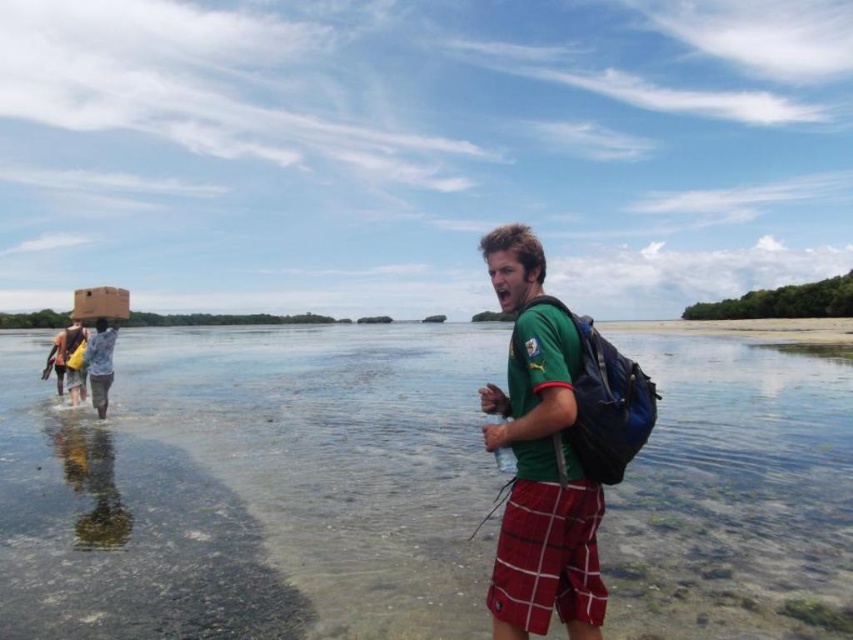
Question: Can you confirm if clear water at center is positioned to the right of green fabric shirt at center?

Choices:
 (A) no
 (B) yes

Answer: (A)

Question: Which object is farther from the camera taking this photo?

Choices:
 (A) cardboard box at left
 (B) green fabric shirt at center

Answer: (A)

Question: Among these points, which one is farthest from the camera?

Choices:
 (A) (91, 320)
 (B) (254, 342)

Answer: (B)

Question: Among these points, which one is nearest to the camera?

Choices:
 (A) (113, 298)
 (B) (743, 513)

Answer: (B)

Question: Can you confirm if clear water at center is positioned below green fabric shirt at center?

Choices:
 (A) yes
 (B) no

Answer: (B)

Question: Does clear water at center have a greater width compared to light blue fabric shirt at left?

Choices:
 (A) yes
 (B) no

Answer: (A)